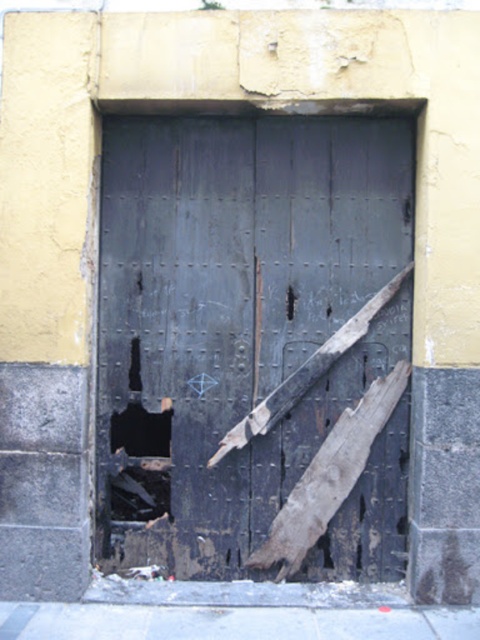
Question: Is charred wood door at center in front of black matte hole at center?

Choices:
 (A) yes
 (B) no

Answer: (A)

Question: Among these objects, which one is nearest to the camera?

Choices:
 (A) rusty metal hole at lower left
 (B) charred wood door at center
 (C) black matte hole at center

Answer: (B)

Question: Which object is the closest to the charred wood door at center?

Choices:
 (A) rusty metal hole at lower left
 (B) black matte hole at center

Answer: (B)

Question: Can you confirm if rusty metal hole at lower left is positioned to the right of black matte hole at center?

Choices:
 (A) yes
 (B) no

Answer: (B)

Question: Considering the real-world distances, which object is closest to the rusty metal hole at lower left?

Choices:
 (A) charred wood door at center
 (B) black matte hole at center

Answer: (B)

Question: Is charred wood door at center to the left of black matte hole at center from the viewer's perspective?

Choices:
 (A) no
 (B) yes

Answer: (A)